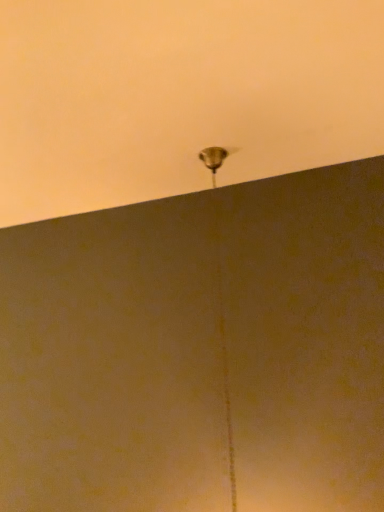
What do you see at coordinates (179, 96) in the screenshot? I see `matte beige ceiling at center` at bounding box center [179, 96].

Where is `matte beige ceiling at center`? matte beige ceiling at center is located at coordinates (179, 96).

What is the approximate height of matte beige ceiling at center?

matte beige ceiling at center is 3.43 inches in height.

In order to face matte beige ceiling at center, should I rotate leftwards or rightwards?

You should rotate left by 12.707 degrees.

Image resolution: width=384 pixels, height=512 pixels. In order to click on matte beige ceiling at center in this screenshot , I will do `click(179, 96)`.